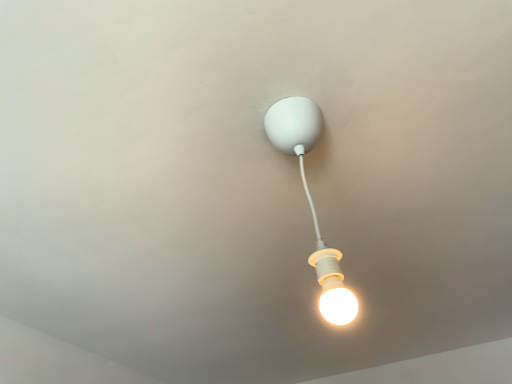
You are a GUI agent. You are given a task and a screenshot of the screen. Output one action in this format:
    pyautogui.click(x=<x>, y=<y>)
    Task: Click on the matte white lamp at center
    
    Given the screenshot: What is the action you would take?
    pyautogui.click(x=311, y=200)

What do you see at coordinates (311, 200) in the screenshot? This screenshot has width=512, height=384. I see `matte white lamp at center` at bounding box center [311, 200].

You are a GUI agent. You are given a task and a screenshot of the screen. Output one action in this format:
    pyautogui.click(x=<x>, y=<y>)
    Task: Click on the matte white lamp at center
    This screenshot has height=384, width=512.
    Given the screenshot: What is the action you would take?
    pyautogui.click(x=311, y=200)